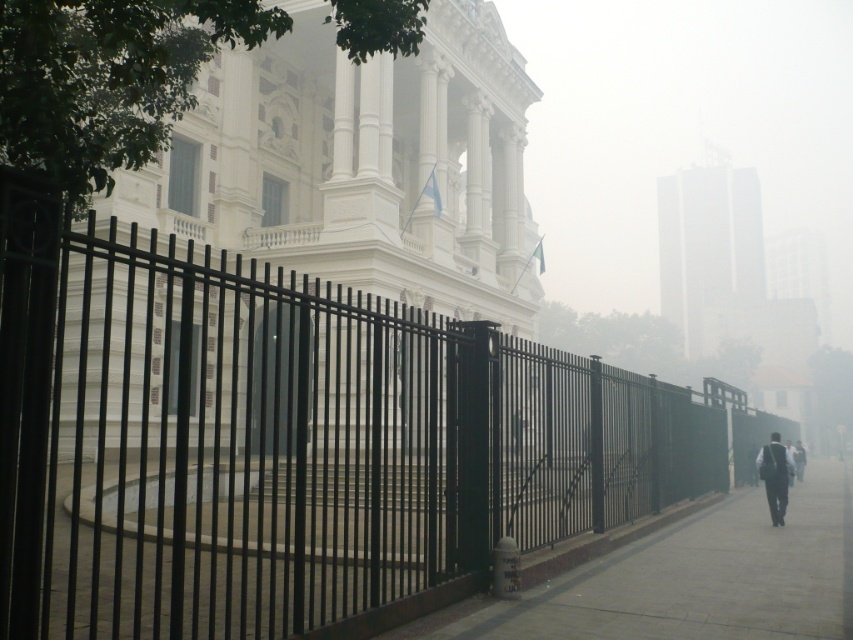
Question: Which is farther from the smooth concrete pavement at lower right?

Choices:
 (A) black metal fence at center
 (B) dark gray suit at center

Answer: (A)

Question: From the image, what is the correct spatial relationship of black metal fence at center in relation to dark gray suit at center?

Choices:
 (A) above
 (B) below

Answer: (A)

Question: Which point is farther from the camera taking this photo?

Choices:
 (A) (416, 428)
 (B) (821, 582)

Answer: (B)

Question: Estimate the real-world distances between objects in this image. Which object is closer to the smooth concrete pavement at lower right?

Choices:
 (A) dark gray suit at center
 (B) black metal fence at center

Answer: (A)

Question: Where is black metal fence at center located in relation to smooth concrete pavement at lower right in the image?

Choices:
 (A) above
 (B) below

Answer: (A)

Question: Can you confirm if black metal fence at center is positioned above dark gray suit at center?

Choices:
 (A) no
 (B) yes

Answer: (B)